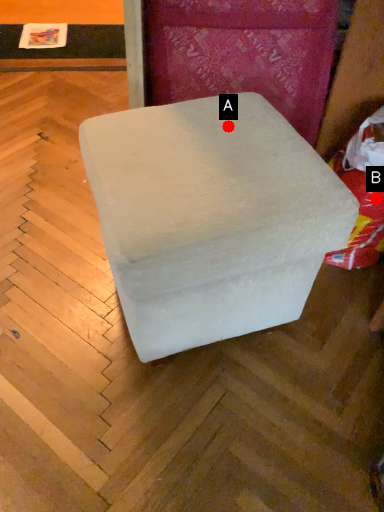
Question: Two points are circled on the image, labeled by A and B beside each circle. Among these points, which one is farthest from the camera?

Choices:
 (A) A is further
 (B) B is further

Answer: (B)